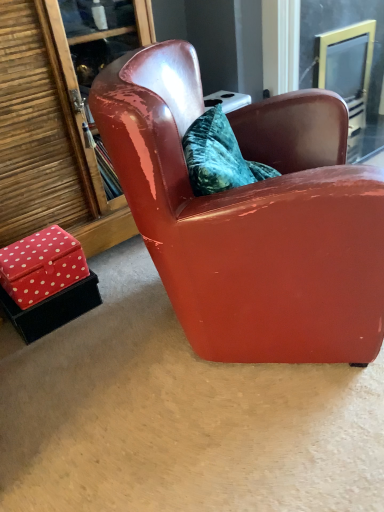
Question: From a real-world perspective, is clear glass screen door at upper right beneath red velvet box at lower left, which is the 1th box in top-to-bottom order?

Choices:
 (A) yes
 (B) no

Answer: (B)

Question: Can you confirm if clear glass screen door at upper right is smaller than red velvet box at lower left, which is the 1th box in top-to-bottom order?

Choices:
 (A) no
 (B) yes

Answer: (A)

Question: Is red velvet box at lower left, which is counted as the 2th box, starting from the bottom, at the back of clear glass screen door at upper right?

Choices:
 (A) yes
 (B) no

Answer: (B)

Question: From a real-world perspective, is clear glass screen door at upper right on red velvet box at lower left, which is the 1th box in top-to-bottom order?

Choices:
 (A) yes
 (B) no

Answer: (A)

Question: Is clear glass screen door at upper right wider than red velvet box at lower left, which is counted as the 2th box, starting from the bottom?

Choices:
 (A) yes
 (B) no

Answer: (A)

Question: Considering the relative sizes of clear glass screen door at upper right and red velvet box at lower left, which is the 1th box in top-to-bottom order, in the image provided, is clear glass screen door at upper right shorter than red velvet box at lower left, which is the 1th box in top-to-bottom order,?

Choices:
 (A) no
 (B) yes

Answer: (A)

Question: From the image's perspective, is red polka dot fabric box at lower left, placed as the 2th box when sorted from top to bottom, located above clear glass screen door at upper right?

Choices:
 (A) no
 (B) yes

Answer: (A)

Question: Can you confirm if red polka dot fabric box at lower left, the 1th box ordered from the bottom, is bigger than clear glass screen door at upper right?

Choices:
 (A) no
 (B) yes

Answer: (A)

Question: Is red polka dot fabric box at lower left, the 1th box ordered from the bottom, closer to the viewer compared to clear glass screen door at upper right?

Choices:
 (A) yes
 (B) no

Answer: (A)

Question: Would you consider red polka dot fabric box at lower left, the 1th box ordered from the bottom, to be distant from clear glass screen door at upper right?

Choices:
 (A) yes
 (B) no

Answer: (A)

Question: Considering the relative positions of red polka dot fabric box at lower left, the 1th box ordered from the bottom, and clear glass screen door at upper right in the image provided, is red polka dot fabric box at lower left, the 1th box ordered from the bottom, behind clear glass screen door at upper right?

Choices:
 (A) no
 (B) yes

Answer: (A)

Question: Is red polka dot fabric box at lower left, the 1th box ordered from the bottom, oriented away from clear glass screen door at upper right?

Choices:
 (A) yes
 (B) no

Answer: (B)

Question: Does red velvet box at lower left, which is the 1th box in top-to-bottom order, have a greater height compared to clear glass screen door at upper right?

Choices:
 (A) yes
 (B) no

Answer: (B)